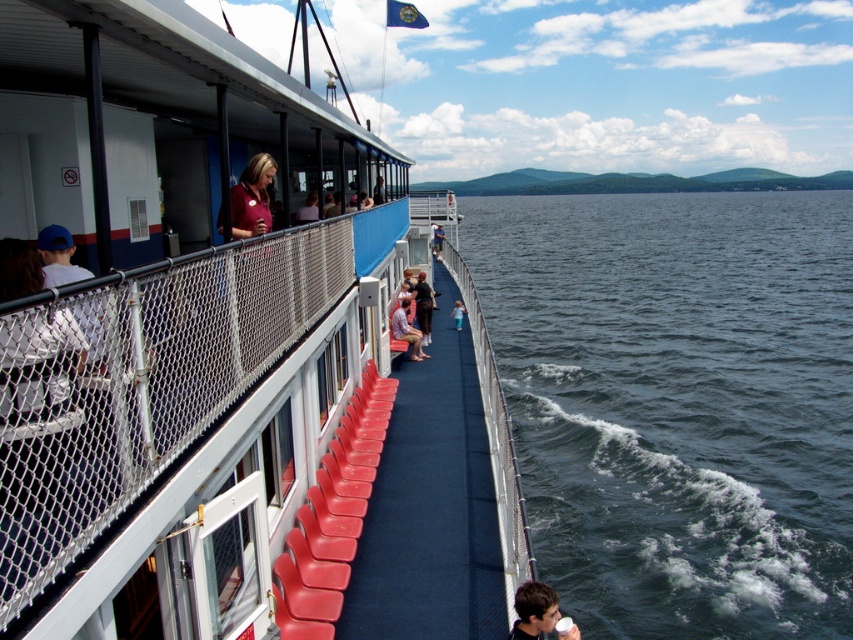
You are standing on the ferry deck and want to reach both points marked on the deck. Which point, point (207,481) or point (537,634), would you reach first if you walk straight towards them?

You would reach point (207,481) first because it is closer to you than point (537,634).

You are a passenger on the ferry and want to sit down. You see the matte red seats at center and the dark blue water at lower right. Which one is closer to you if you are standing on the ferry deck?

The matte red seats at center is closer because it is below the dark blue water at lower right, meaning the seats are positioned lower on the deck and thus nearer to your standing position.

You are standing on the ferry deck and want to take a photo of the distant hills. You have a camera that can only focus on objects at a certain distance. To ensure both the matte red seats at center and the matte black shirt at lower right are in focus, which object should you focus on and why?

You should focus on the matte red seats at center because it is closer to the viewer than the matte black shirt at lower right. By focusing on the closer object, the depth of field will extend further, potentially keeping both objects in focus.